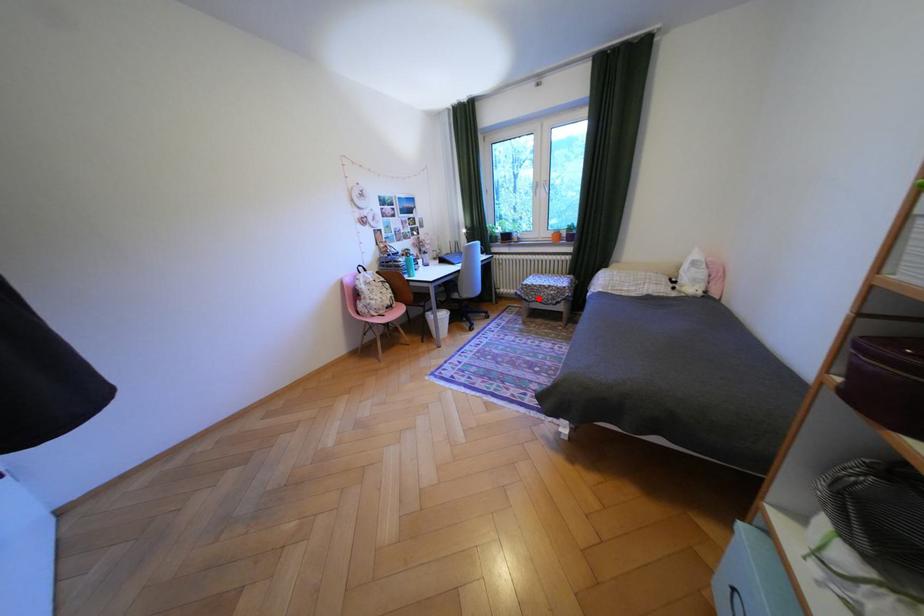
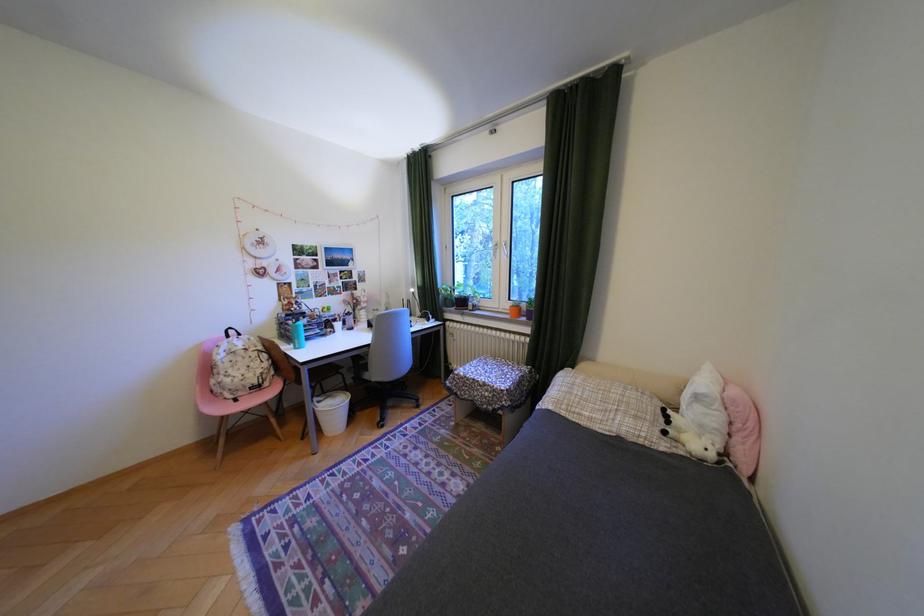
Locate, in the second image, the point that corresponds to the highlighted location in the first image.

(470, 392)